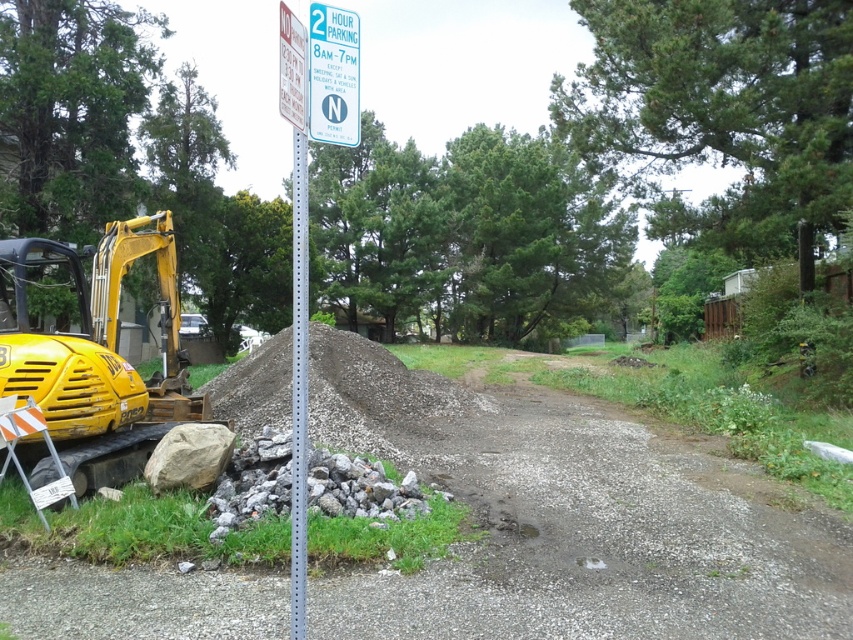
You are a delivery driver who needs to park your truck near the yellow rubber excavator at lower left. The parking sign on the metallic gray pole at upper center says you can only park for 2 hours between 8 AM and 7 PM. If you arrive at 9 AM, how long can you safely park here before violating the parking rules?

The parking sign on the metallic gray pole at upper center allows parking for 2 hours between 8 AM and 7 PM. Since you arrive at 9 AM, you can park until 11 AM to comply with the 2 hour limit without exceeding the time frame.

You are a delivery driver who needs to park your truck near the yellow rubber excavator at lower left for unloading. The parking sign in the middle says you can park for 2 hours between 8 AM and 7 PM. If you arrive at 9 AM, can you safely park your truck on the gray gravel dirt track at center without violating the parking rules and ensuring enough space for the excavator to move?

The gray gravel dirt track at center and yellow rubber excavator at lower left are 14.86 feet apart. Since the parking sign allows 2 hour parking from 8 AM to 7 PM, arriving at 9 AM gives you until 11 AM to unload. However, the distance between the track and excavator may not provide enough space for the excavator to move safely. Check local regulations or consult the site supervisor for clearance requirements.